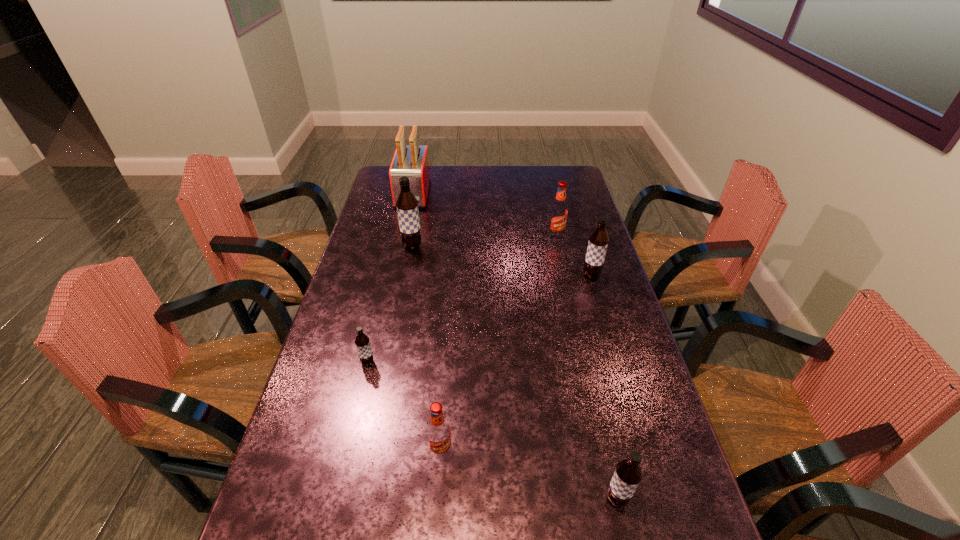
Locate an element on the screen. This screenshot has width=960, height=540. the closest brown root beer relative to the right red root beer is located at coordinates (598, 242).

I want to click on red root beer that is the second closest to the biggest brown root beer, so click(439, 436).

You are a GUI agent. You are given a task and a screenshot of the screen. Output one action in this format:
    pyautogui.click(x=<x>, y=<y>)
    Task: Click on the red root beer that stands as the second closest to the nearest root beer
    This screenshot has height=540, width=960.
    Given the screenshot: What is the action you would take?
    coord(558,213)

Identify the location of vacant region that satisfies the following two spatial constraints: 1. on the front-facing side of the tallest root beer; 2. on the right side of the red toaster. (401, 246).

At what (x,y) coordinates should I click in order to perform the action: click on vacant region that satisfies the following two spatial constraints: 1. on the front side of the right red root beer; 2. on the left side of the third nearest brown root beer. Please return your answer as a coordinate pair (x, y). Image resolution: width=960 pixels, height=540 pixels. Looking at the image, I should click on (564, 275).

In order to click on blank area in the image that satisfies the following two spatial constraints: 1. on the front-facing side of the toaster; 2. on the left side of the third root beer from left to right in this screenshot , I will do click(x=356, y=451).

You are a GUI agent. You are given a task and a screenshot of the screen. Output one action in this format:
    pyautogui.click(x=<x>, y=<y>)
    Task: Click on the free point that satisfies the following two spatial constraints: 1. on the back side of the shortest root beer; 2. on the left side of the second root beer from left to right
    
    Given the screenshot: What is the action you would take?
    pyautogui.click(x=396, y=246)

At what (x,y) coordinates should I click in order to perform the action: click on vacant space that satisfies the following two spatial constraints: 1. on the front-facing side of the second nearest root beer; 2. on the right side of the red toaster. Please return your answer as a coordinate pair (x, y). This screenshot has width=960, height=540. Looking at the image, I should click on (356, 451).